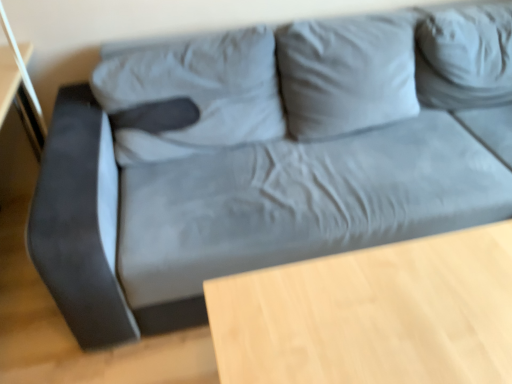
Where is `vacant area on top of light wood table at lower right (from a real-world perspective)`? The width and height of the screenshot is (512, 384). vacant area on top of light wood table at lower right (from a real-world perspective) is located at coordinates (397, 306).